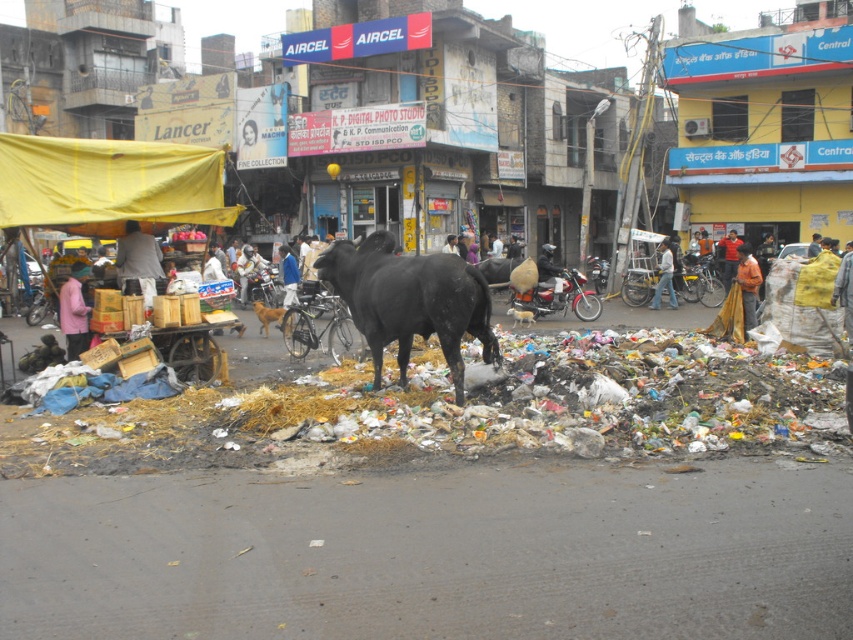
Looking at this image, you are a photographer trying to capture both the orange cotton shirt at center and the brown fur dog at center in a single frame. Which object should you focus on first if you want to ensure both are in focus, considering their sizes?

The orange cotton shirt at center is thinner than the brown fur dog at center, so you should focus on the brown fur dog at center first to ensure both are in focus.

You are a photographer trying to capture both the orange cotton shirt at center and the brown fur dog at center in a single frame. Which object should you focus on first to ensure both are in the frame?

The orange cotton shirt at center is taller than the brown fur dog at center, so focusing on the orange cotton shirt at center first will help ensure both are in the frame.